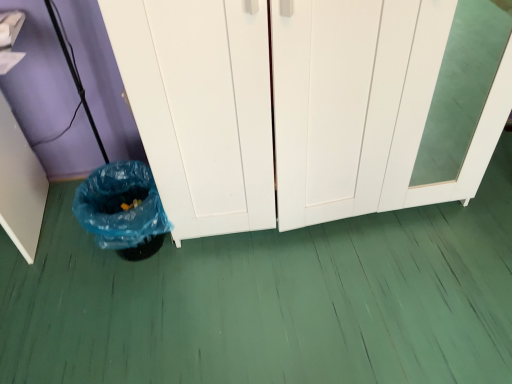
At what (x,y) coordinates should I click in order to perform the action: click on blue plastic bag at lower left. Please return your answer as a coordinate pair (x, y). Looking at the image, I should click on (122, 209).

Describe the element at coordinates (122, 209) in the screenshot. The width and height of the screenshot is (512, 384). I see `blue plastic bag at lower left` at that location.

The height and width of the screenshot is (384, 512). What are the coordinates of `blue plastic bag at lower left` in the screenshot? It's located at (122, 209).